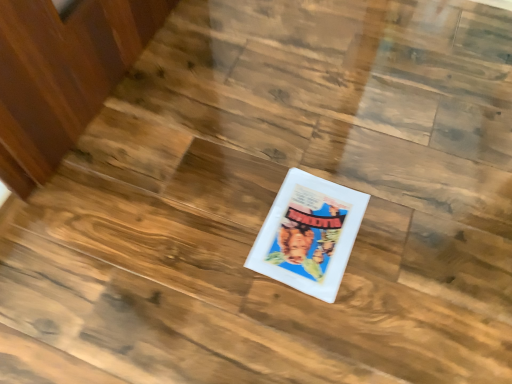
Locate an element on the screen. The height and width of the screenshot is (384, 512). free spot below white glossy book at center (from a real-world perspective) is located at coordinates (308, 229).